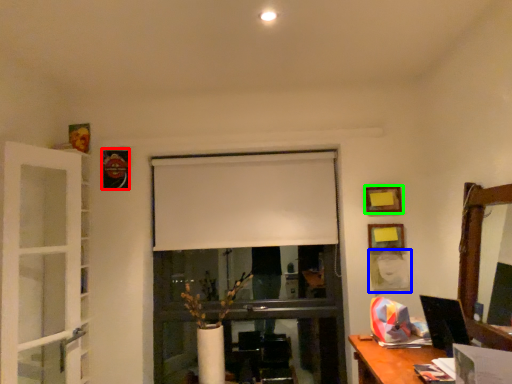
Question: Based on their relative distances, which object is farther from picture frame (highlighted by a red box)? Choose from picture frame (highlighted by a blue box) and picture frame (highlighted by a green box).

Choices:
 (A) picture frame
 (B) picture frame

Answer: (A)